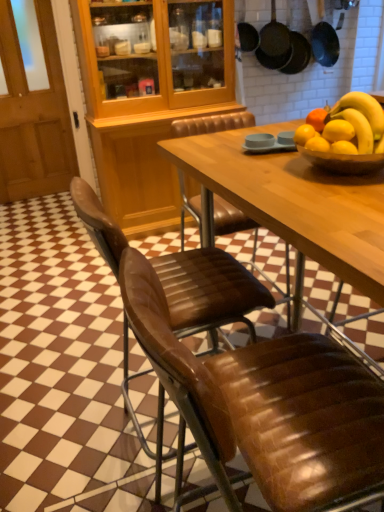
The width and height of the screenshot is (384, 512). Describe the element at coordinates (209, 291) in the screenshot. I see `brown leather chair at center, which is counted as the second chair, starting from the front` at that location.

Where is `brown leather chair at center, which appears as the first chair when viewed from the back`? brown leather chair at center, which appears as the first chair when viewed from the back is located at coordinates (209, 291).

Locate an element on the screen. The height and width of the screenshot is (512, 384). black matte frying pan at upper center, the second frying pan positioned from the right is located at coordinates (274, 42).

How much space does black matte frying pan at upper right, acting as the 1th frying pan starting from the right, occupy horizontally?

black matte frying pan at upper right, acting as the 1th frying pan starting from the right, is 19.51 centimeters in width.

Locate an element on the screen. The height and width of the screenshot is (512, 384). brown leather chair at center, positioned as the 1th chair in front-to-back order is located at coordinates (267, 407).

Where is `brown leather chair at center, which appears as the first chair when viewed from the back`? brown leather chair at center, which appears as the first chair when viewed from the back is located at coordinates (209, 291).

Considering the relative sizes of brown leather chair at center, which appears as the first chair when viewed from the back, and black matte frying pan at upper right, arranged as the first frying pan when viewed from the left, in the image provided, is brown leather chair at center, which appears as the first chair when viewed from the back, taller than black matte frying pan at upper right, arranged as the first frying pan when viewed from the left,?

Yes.

Can you tell me how much brown leather chair at center, which is counted as the second chair, starting from the front, and black matte frying pan at upper right, arranged as the first frying pan when viewed from the left, differ in facing direction?

89.7 degrees separate the facing orientations of brown leather chair at center, which is counted as the second chair, starting from the front, and black matte frying pan at upper right, arranged as the first frying pan when viewed from the left.

Considering the relative sizes of brown leather chair at center, which appears as the first chair when viewed from the back, and black matte frying pan at upper right, arranged as the first frying pan when viewed from the left, in the image provided, is brown leather chair at center, which appears as the first chair when viewed from the back, smaller than black matte frying pan at upper right, arranged as the first frying pan when viewed from the left,?

No.

Which point is more distant from viewer, (192, 448) or (238, 22)?

Point (238, 22)

From the image's perspective, would you say black matte frying pan at upper center, the second frying pan positioned from the right, is positioned over brown leather chair at center, which is counted as the second chair, starting from the front?

Correct, black matte frying pan at upper center, the second frying pan positioned from the right, appears higher than brown leather chair at center, which is counted as the second chair, starting from the front, in the image.

Is black matte frying pan at upper center, the second frying pan positioned from the right, taller than brown leather chair at center, which is counted as the second chair, starting from the front?

No, black matte frying pan at upper center, the second frying pan positioned from the right, is not taller than brown leather chair at center, which is counted as the second chair, starting from the front.

Between point (287, 31) and point (114, 248), which one is positioned behind?

Positioned behind is point (287, 31).

How many degrees apart are the facing directions of black matte frying pan at upper center, acting as the 2th frying pan starting from the left, and brown leather chair at center, which is counted as the second chair, starting from the front?

black matte frying pan at upper center, acting as the 2th frying pan starting from the left, and brown leather chair at center, which is counted as the second chair, starting from the front, are facing 93.4 degrees away from each other.

Is black matte frying pan at upper right, acting as the 1th frying pan starting from the right, behind brown leather chair at center, positioned as the 1th chair in front-to-back order?

Yes, the depth of black matte frying pan at upper right, acting as the 1th frying pan starting from the right, is greater than that of brown leather chair at center, positioned as the 1th chair in front-to-back order.

Considering the sizes of objects black matte frying pan at upper right, acting as the 1th frying pan starting from the right, and brown leather chair at center, the second chair viewed from the back, in the image provided, who is taller, black matte frying pan at upper right, acting as the 1th frying pan starting from the right, or brown leather chair at center, the second chair viewed from the back,?

Standing taller between the two is brown leather chair at center, the second chair viewed from the back.

Does point (308, 62) appear closer or farther from the camera than point (143, 326)?

Point (308, 62) is positioned farther from the camera compared to point (143, 326).

Is black matte frying pan at upper right, acting as the 1th frying pan starting from the right, located outside brown leather chair at center, the second chair viewed from the back?

Absolutely, black matte frying pan at upper right, acting as the 1th frying pan starting from the right, is external to brown leather chair at center, the second chair viewed from the back.

Measure the distance from black matte frying pan at upper right, which is counted as the third frying pan, starting from the left, to black matte frying pan at upper right, arranged as the first frying pan when viewed from the left.

black matte frying pan at upper right, which is counted as the third frying pan, starting from the left, and black matte frying pan at upper right, arranged as the first frying pan when viewed from the left, are 14.07 inches apart.

Considering the relative sizes of black matte frying pan at upper right, which is counted as the third frying pan, starting from the left, and black matte frying pan at upper right, the third frying pan when ordered from right to left, in the image provided, is black matte frying pan at upper right, which is counted as the third frying pan, starting from the left, bigger than black matte frying pan at upper right, the third frying pan when ordered from right to left,?

Indeed, black matte frying pan at upper right, which is counted as the third frying pan, starting from the left, has a larger size compared to black matte frying pan at upper right, the third frying pan when ordered from right to left.

Is black matte frying pan at upper right, which is counted as the third frying pan, starting from the left, facing towards black matte frying pan at upper right, arranged as the first frying pan when viewed from the left?

No, black matte frying pan at upper right, which is counted as the third frying pan, starting from the left, is not aimed at black matte frying pan at upper right, arranged as the first frying pan when viewed from the left.

Is black matte frying pan at upper right, acting as the 1th frying pan starting from the right, positioned beyond the bounds of black matte frying pan at upper right, arranged as the first frying pan when viewed from the left?

Yes, black matte frying pan at upper right, acting as the 1th frying pan starting from the right, is not within black matte frying pan at upper right, arranged as the first frying pan when viewed from the left.

From a real-world perspective, is black matte frying pan at upper right, the third frying pan when ordered from right to left, under brown leather chair at center, which is counted as the second chair, starting from the front?

Incorrect, from a real-world perspective, black matte frying pan at upper right, the third frying pan when ordered from right to left, is higher than brown leather chair at center, which is counted as the second chair, starting from the front.

Is black matte frying pan at upper right, the third frying pan when ordered from right to left, taller or shorter than brown leather chair at center, which appears as the first chair when viewed from the back?

black matte frying pan at upper right, the third frying pan when ordered from right to left, is shorter than brown leather chair at center, which appears as the first chair when viewed from the back.

From the picture: Is black matte frying pan at upper right, arranged as the first frying pan when viewed from the left, wider or thinner than brown leather chair at center, which is counted as the second chair, starting from the front?

black matte frying pan at upper right, arranged as the first frying pan when viewed from the left, is thinner than brown leather chair at center, which is counted as the second chair, starting from the front.

Considering the sizes of black matte frying pan at upper right, arranged as the first frying pan when viewed from the left, and brown leather chair at center, which appears as the first chair when viewed from the back, in the image, is black matte frying pan at upper right, arranged as the first frying pan when viewed from the left, bigger or smaller than brown leather chair at center, which appears as the first chair when viewed from the back,?

Clearly, black matte frying pan at upper right, arranged as the first frying pan when viewed from the left, is smaller in size than brown leather chair at center, which appears as the first chair when viewed from the back.

Is black matte frying pan at upper right, which is counted as the third frying pan, starting from the left, wider or thinner than wooden door at left?

black matte frying pan at upper right, which is counted as the third frying pan, starting from the left, is wider than wooden door at left.

Which of these two, black matte frying pan at upper right, acting as the 1th frying pan starting from the right, or wooden door at left, stands shorter?

black matte frying pan at upper right, acting as the 1th frying pan starting from the right.

Between black matte frying pan at upper right, acting as the 1th frying pan starting from the right, and wooden door at left, which one is positioned behind?

black matte frying pan at upper right, acting as the 1th frying pan starting from the right, is behind.

Is black matte frying pan at upper right, which is counted as the third frying pan, starting from the left, bigger than wooden door at left?

Actually, black matte frying pan at upper right, which is counted as the third frying pan, starting from the left, might be smaller than wooden door at left.

Between brown leather chair at center, positioned as the 1th chair in front-to-back order, and brown leather chair at center, which appears as the first chair when viewed from the back, which one has larger size?

With larger size is brown leather chair at center, positioned as the 1th chair in front-to-back order.

From the image's perspective, which is below, brown leather chair at center, the second chair viewed from the back, or brown leather chair at center, which appears as the first chair when viewed from the back?

From the image's view, brown leather chair at center, the second chair viewed from the back, is below.

Based on their positions, is brown leather chair at center, the second chair viewed from the back, located to the left or right of brown leather chair at center, which appears as the first chair when viewed from the back?

Based on their positions, brown leather chair at center, the second chair viewed from the back, is located to the right of brown leather chair at center, which appears as the first chair when viewed from the back.

Looking at this image, are brown leather chair at center, positioned as the 1th chair in front-to-back order, and brown leather chair at center, which appears as the first chair when viewed from the back, far apart?

No, there isn't a large distance between brown leather chair at center, positioned as the 1th chair in front-to-back order, and brown leather chair at center, which appears as the first chair when viewed from the back.

In order to click on the 1st frying pan counting from the right of the brown leather chair at center, which is counted as the second chair, starting from the front in this screenshot , I will do `click(246, 31)`.

Locate an element on the screen. This screenshot has width=384, height=512. the 2nd chair to the left of the black matte frying pan at upper center, acting as the 2th frying pan starting from the left, counting from the anchor's position is located at coordinates (209, 291).

From the image, which object appears to be farther from black matte frying pan at upper right, the third frying pan when ordered from right to left, black matte frying pan at upper right, acting as the 1th frying pan starting from the right, or black matte frying pan at upper center, the second frying pan positioned from the right?

Based on the image, black matte frying pan at upper right, acting as the 1th frying pan starting from the right, appears to be further to black matte frying pan at upper right, the third frying pan when ordered from right to left.

Estimate the real-world distances between objects in this image. Which object is closer to brown leather chair at center, positioned as the 1th chair in front-to-back order, brown leather chair at center, which appears as the first chair when viewed from the back, or wooden door at left?

brown leather chair at center, which appears as the first chair when viewed from the back.

Estimate the real-world distances between objects in this image. Which object is further from brown leather chair at center, which appears as the first chair when viewed from the back, black matte frying pan at upper right, the third frying pan when ordered from right to left, or wooden door at left?

wooden door at left is further to brown leather chair at center, which appears as the first chair when viewed from the back.

Which object lies nearer to the anchor point black matte frying pan at upper right, which is counted as the third frying pan, starting from the left, wooden door at left or black matte frying pan at upper center, acting as the 2th frying pan starting from the left?

black matte frying pan at upper center, acting as the 2th frying pan starting from the left, lies closer to black matte frying pan at upper right, which is counted as the third frying pan, starting from the left, than the other object.

When comparing their distances from wooden door at left, does brown leather chair at center, positioned as the 1th chair in front-to-back order, or black matte frying pan at upper right, the third frying pan when ordered from right to left, seem further?

brown leather chair at center, positioned as the 1th chair in front-to-back order, is further to wooden door at left.

Looking at the image, which one is located further to wooden door at left, black matte frying pan at upper right, which is counted as the third frying pan, starting from the left, or brown leather chair at center, the second chair viewed from the back?

Among the two, brown leather chair at center, the second chair viewed from the back, is located further to wooden door at left.

Which object lies further to the anchor point brown leather chair at center, positioned as the 1th chair in front-to-back order, black matte frying pan at upper right, arranged as the first frying pan when viewed from the left, or black matte frying pan at upper right, which is counted as the third frying pan, starting from the left?

The object further to brown leather chair at center, positioned as the 1th chair in front-to-back order, is black matte frying pan at upper right, which is counted as the third frying pan, starting from the left.

Estimate the real-world distances between objects in this image. Which object is further from black matte frying pan at upper right, the third frying pan when ordered from right to left, black matte frying pan at upper center, the second frying pan positioned from the right, or black matte frying pan at upper right, which is counted as the third frying pan, starting from the left?

black matte frying pan at upper right, which is counted as the third frying pan, starting from the left.

The height and width of the screenshot is (512, 384). In order to click on frying pan between wooden door at left and black matte frying pan at upper center, the second frying pan positioned from the right, in the horizontal direction in this screenshot , I will do `click(246, 31)`.

Where is `chair between brown leather chair at center, the second chair viewed from the back, and black matte frying pan at upper right, acting as the 1th frying pan starting from the right, along the z-axis`? chair between brown leather chair at center, the second chair viewed from the back, and black matte frying pan at upper right, acting as the 1th frying pan starting from the right, along the z-axis is located at coordinates (209, 291).

Locate an element on the screen. The image size is (384, 512). glass door located between brown leather chair at center, the second chair viewed from the back, and black matte frying pan at upper right, acting as the 1th frying pan starting from the right, in the depth direction is located at coordinates (32, 104).

The height and width of the screenshot is (512, 384). Find the location of `chair between brown leather chair at center, the second chair viewed from the back, and black matte frying pan at upper right, arranged as the first frying pan when viewed from the left, from front to back`. chair between brown leather chair at center, the second chair viewed from the back, and black matte frying pan at upper right, arranged as the first frying pan when viewed from the left, from front to back is located at coordinates (209, 291).